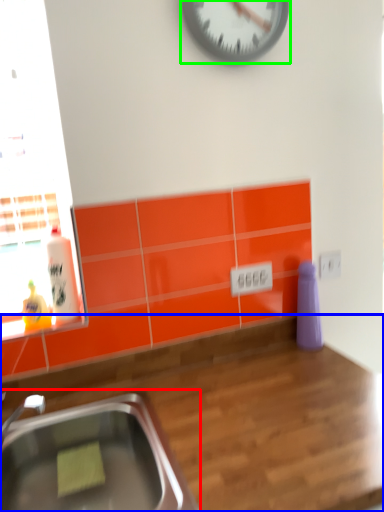
Question: Based on their relative distances, which object is farther from sink (highlighted by a red box)? Choose from countertop (highlighted by a blue box) and wall clock (highlighted by a green box).

Choices:
 (A) countertop
 (B) wall clock

Answer: (B)